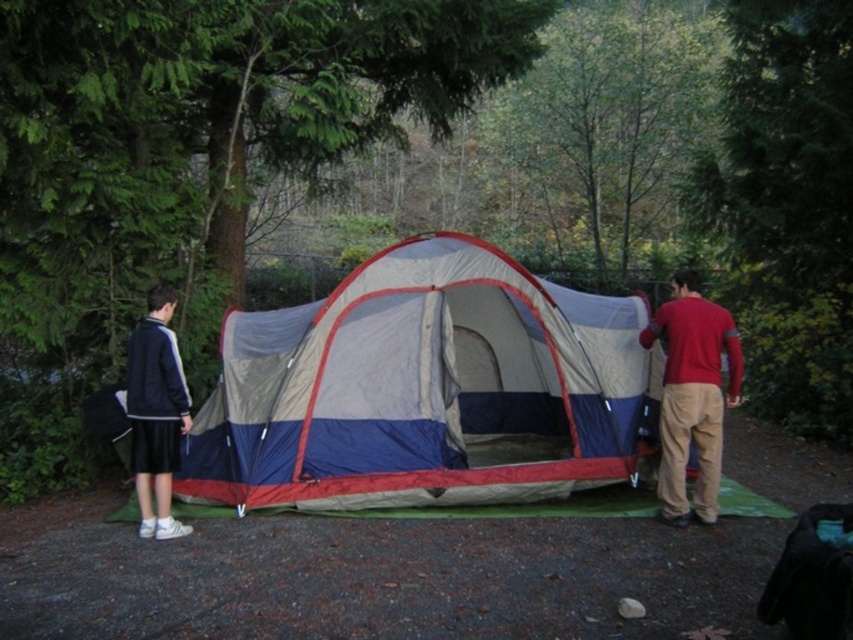
Does red cotton shirt at center have a smaller size compared to dark blue jacket at left?

No, red cotton shirt at center is not smaller than dark blue jacket at left.

Which is above, red cotton shirt at center or dark blue jacket at left?

red cotton shirt at center is above.

Find the location of a particular element. red cotton shirt at center is located at coordinates (692, 394).

How distant is blue tarpaulin tent at center from red cotton shirt at center?

blue tarpaulin tent at center and red cotton shirt at center are 1.60 meters apart.

Does blue tarpaulin tent at center have a greater height compared to red cotton shirt at center?

Indeed, blue tarpaulin tent at center has a greater height compared to red cotton shirt at center.

Where is `blue tarpaulin tent at center`? The width and height of the screenshot is (853, 640). blue tarpaulin tent at center is located at coordinates (425, 388).

Does blue tarpaulin tent at center have a larger size compared to dark blue jacket at left?

Yes.

Where is `blue tarpaulin tent at center`? Image resolution: width=853 pixels, height=640 pixels. blue tarpaulin tent at center is located at coordinates (425, 388).

Who is more forward, (312, 493) or (134, 406)?

Positioned in front is point (134, 406).

Identify the location of blue tarpaulin tent at center. (425, 388).